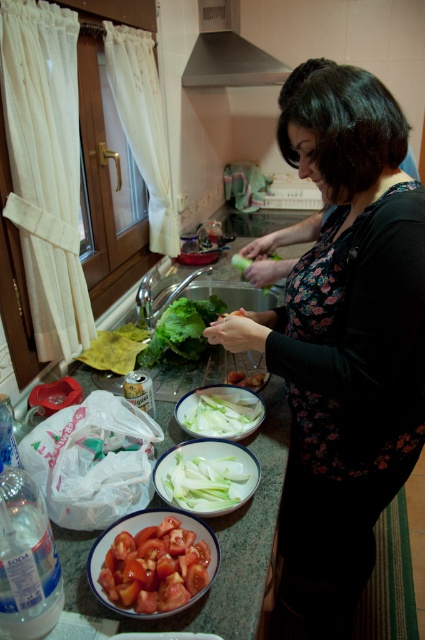
Question: Which object is farther from the camera taking this photo?

Choices:
 (A) white smooth onion at center
 (B) sliced matte tomato at lower left

Answer: (A)

Question: Based on their relative distances, which object is nearer to the white glossy counter top at center?

Choices:
 (A) stainless steel exhaust hood at upper center
 (B) floral-patterned fabric at center

Answer: (B)

Question: Does floral-patterned fabric at center appear under sliced matte tomato at lower left?

Choices:
 (A) no
 (B) yes

Answer: (A)

Question: Which point appears farthest from the camera in this image?

Choices:
 (A) (356, 353)
 (B) (243, 218)

Answer: (B)

Question: Is white glossy counter top at center above white glossy platter at center?

Choices:
 (A) yes
 (B) no

Answer: (B)

Question: Is sliced matte tomato at lower left below white glossy platter at center?

Choices:
 (A) no
 (B) yes

Answer: (B)